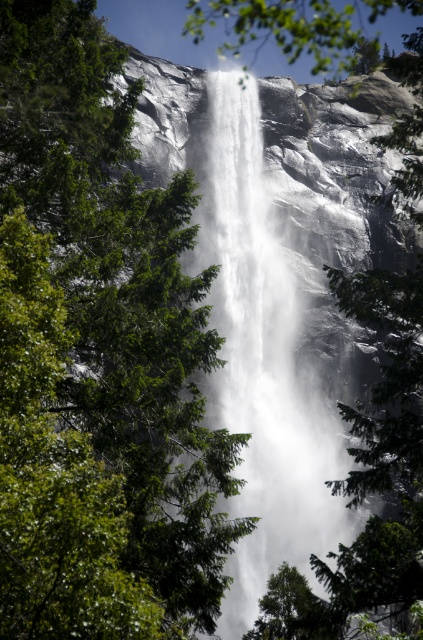
You are a hiker standing at the base of the waterfall. You notice a green leafy tree at center and a white frothy water at center. Which object appears closer to you in the image?

The green leafy tree at center is smaller than the white frothy water at center, so the white frothy water at center appears closer to you.

You are standing in front of the waterfall and want to take a photo of the green leafy tree at center and the white frothy water at center. Which object will appear larger in your photo?

The green leafy tree at center will appear larger in the photo because it is closer to the viewer than the white frothy water at center.

You are standing at the edge of the waterfall and see the green leafy tree at center and the white frothy water at center. Which object is positioned more to the right?

The white frothy water at center is positioned more to the right than the green leafy tree at center.